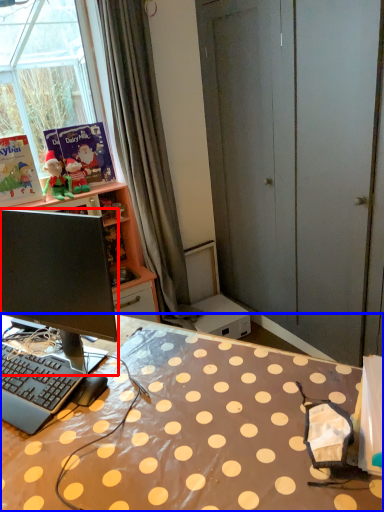
Question: Which object is closer to the camera taking this photo, computer monitor (highlighted by a red box) or desk (highlighted by a blue box)?

Choices:
 (A) computer monitor
 (B) desk

Answer: (B)